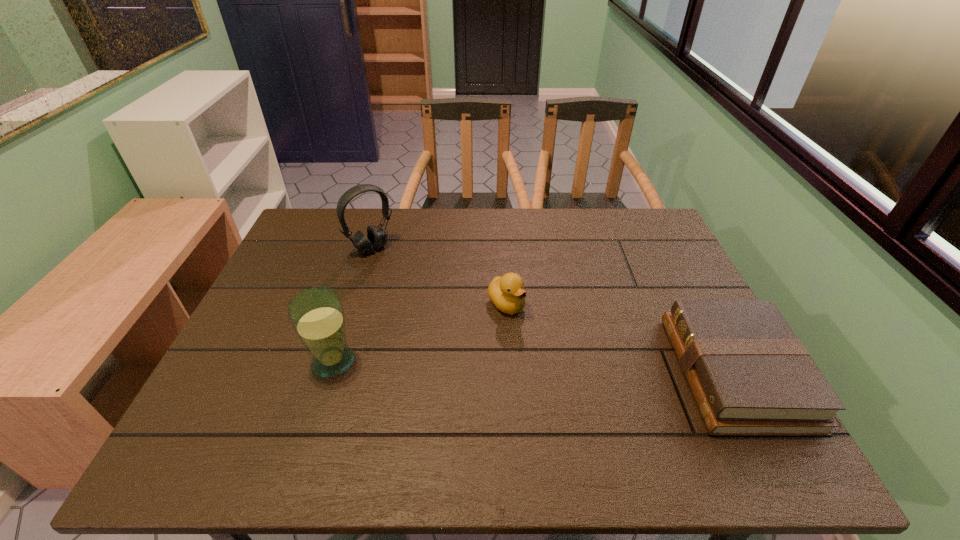
In the image, there is a desktop. Where is `free region at the far edge`? The image size is (960, 540). free region at the far edge is located at coordinates (398, 213).

Identify the location of free space at the near edge. (534, 415).

In the image, there is a desktop. Where is `vacant space at the left edge`? vacant space at the left edge is located at coordinates (282, 345).

You are a GUI agent. You are given a task and a screenshot of the screen. Output one action in this format:
    pyautogui.click(x=<x>, y=<y>)
    Task: Click on the vacant space at the right edge of the desktop
    The width and height of the screenshot is (960, 540).
    Given the screenshot: What is the action you would take?
    pyautogui.click(x=632, y=274)

Identify the location of blank space at the far left corner of the desktop. This screenshot has width=960, height=540. (324, 219).

The width and height of the screenshot is (960, 540). What are the coordinates of `vacant space at the far right corner of the desktop` in the screenshot? It's located at [x=658, y=230].

Image resolution: width=960 pixels, height=540 pixels. In the image, there is a desktop. In order to click on vacant space at the near right corner in this screenshot , I will do `click(699, 409)`.

This screenshot has width=960, height=540. What are the coordinates of `free space between the second farthest object and the glass` in the screenshot? It's located at (420, 333).

Find the location of `free spot between the glass and the shortest object`. free spot between the glass and the shortest object is located at coordinates (535, 367).

The width and height of the screenshot is (960, 540). I want to click on free space between the rightmost object and the farthest object, so click(x=554, y=310).